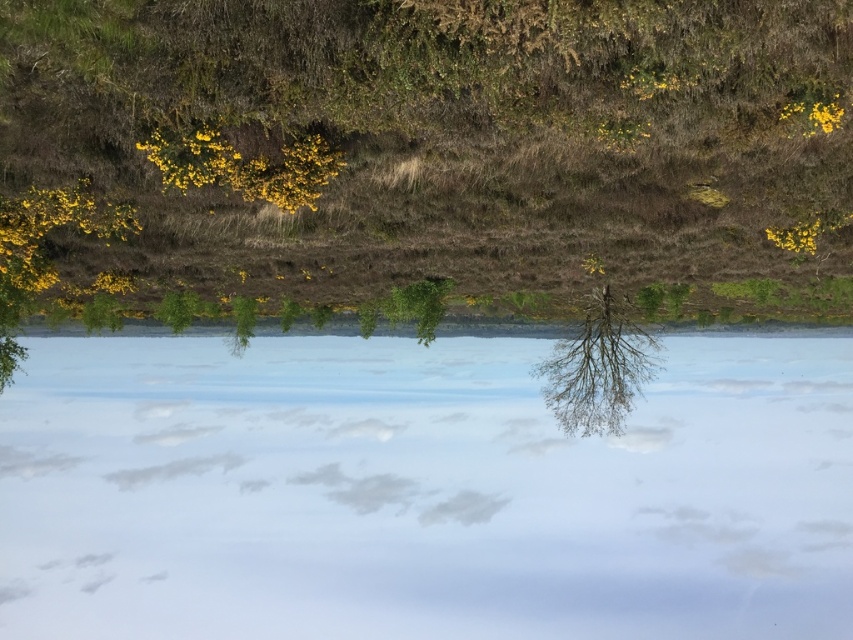
Image resolution: width=853 pixels, height=640 pixels. Describe the element at coordinates (421, 492) in the screenshot. I see `transparent glass water at center` at that location.

Which is below, transparent glass water at center or bare branches tree at center?

transparent glass water at center is below.

Find the location of a particular element. transparent glass water at center is located at coordinates (421, 492).

Locate an element on the screen. transparent glass water at center is located at coordinates [x=421, y=492].